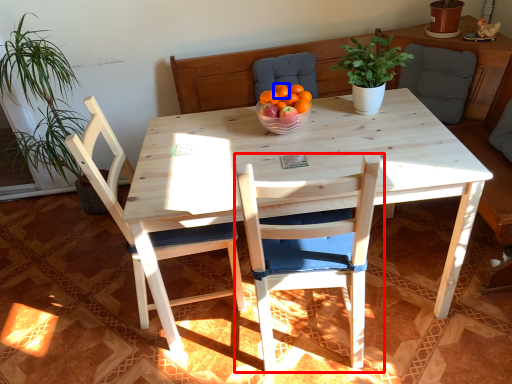
Question: Among these objects, which one is farthest to the camera, chair (highlighted by a red box) or tangerine (highlighted by a blue box)?

Choices:
 (A) chair
 (B) tangerine

Answer: (B)